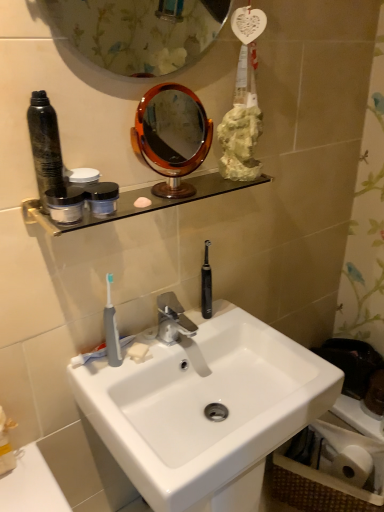
Find the location of a particular element. free space to the left of white matte soap at sink is located at coordinates (109, 358).